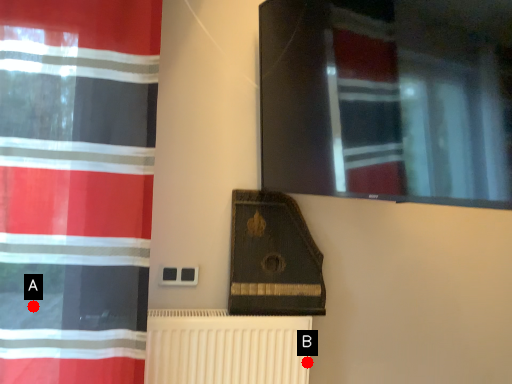
Question: Two points are circled on the image, labeled by A and B beside each circle. Which point is further to the camera?

Choices:
 (A) A is further
 (B) B is further

Answer: (B)